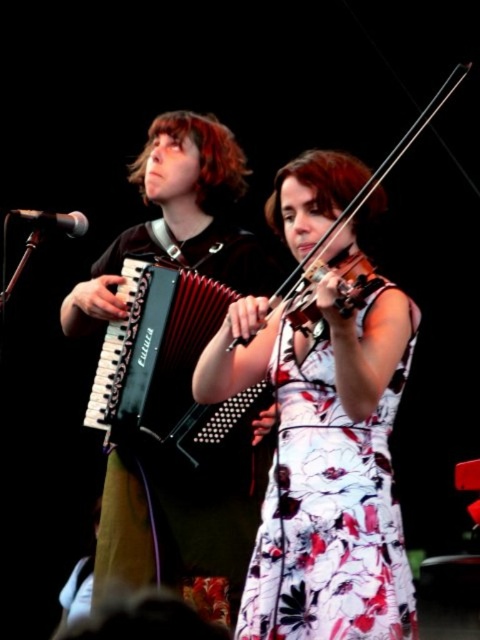
Which is in front, point (136, 349) or point (82, 220)?

Positioned in front is point (82, 220).

Who is positioned more to the right, black plastic accordion at left or black matte microphone at upper left?

Positioned to the right is black plastic accordion at left.

Is point (251, 413) less distant than point (52, 220)?

No.

Where is `black plastic accordion at left`? black plastic accordion at left is located at coordinates (167, 369).

Can you confirm if black matte accordion at left is shorter than black plastic accordion at left?

In fact, black matte accordion at left may be taller than black plastic accordion at left.

Can you confirm if black matte accordion at left is positioned to the right of black plastic accordion at left?

Correct, you'll find black matte accordion at left to the right of black plastic accordion at left.

Who is more distant from viewer, (75, 307) or (238, 440)?

The point (75, 307) is behind.

You are a GUI agent. You are given a task and a screenshot of the screen. Output one action in this format:
    pyautogui.click(x=<x>, y=<y>)
    Task: Click on the black matte accordion at left
    This screenshot has width=480, height=640.
    Given the screenshot: What is the action you would take?
    pyautogui.click(x=187, y=516)

Can you confirm if black plastic accordion at left is smaller than wooden violin at center?

No, black plastic accordion at left is not smaller than wooden violin at center.

Which is behind, point (147, 397) or point (351, 216)?

Positioned behind is point (147, 397).

Is point (153, 356) positioned after point (369, 276)?

Yes, it is.

Identify the location of black plastic accordion at left. The height and width of the screenshot is (640, 480). (167, 369).